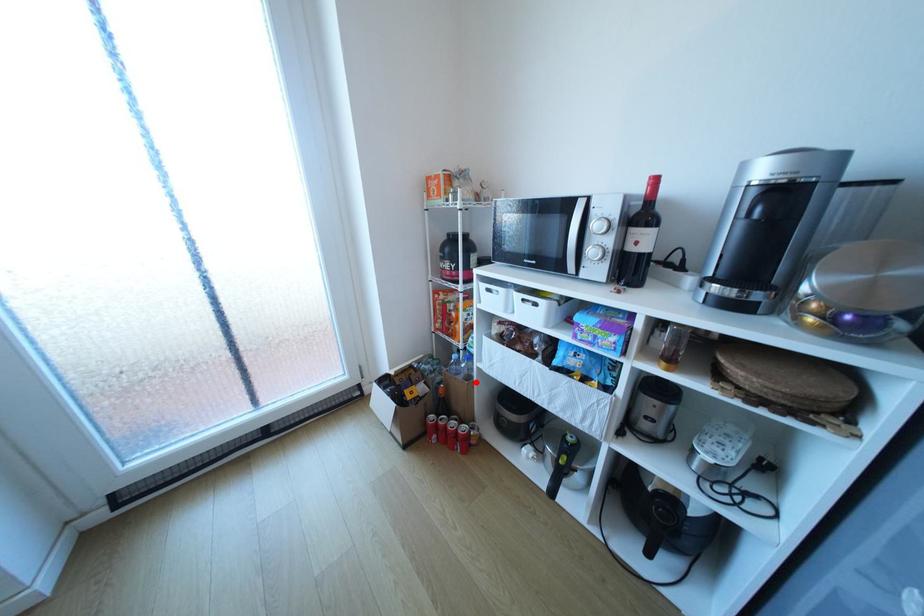
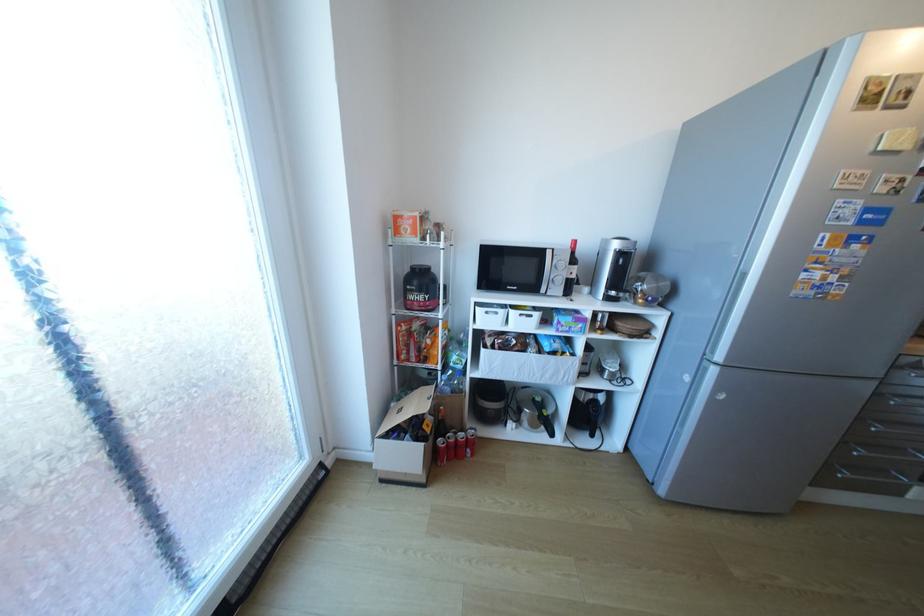
Locate, in the second image, the point that corresponds to the highlighted location in the first image.

(472, 394)